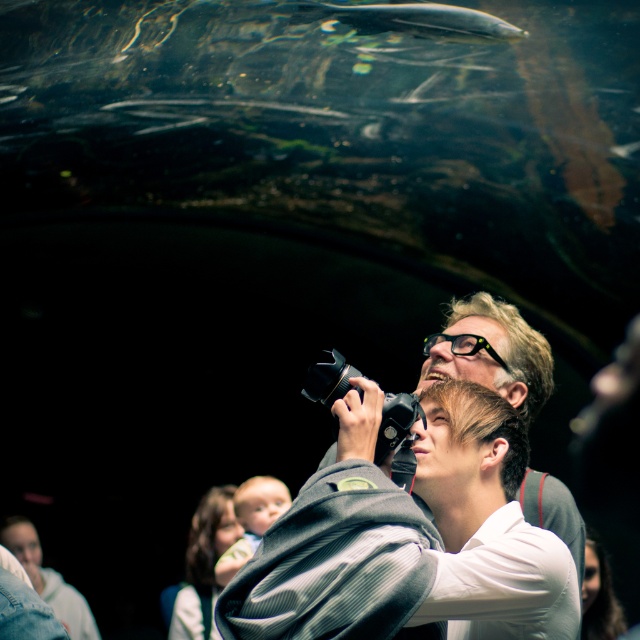
Question: Which object appears closest to the camera in this image?

Choices:
 (A) silvery smooth fish at upper center
 (B) matte gray jacket at center

Answer: (B)

Question: Considering the relative positions of matte gray jacket at center and silvery smooth fish at upper center in the image provided, where is matte gray jacket at center located with respect to silvery smooth fish at upper center?

Choices:
 (A) above
 (B) below

Answer: (B)

Question: Among these objects, which one is farthest from the camera?

Choices:
 (A) matte gray jacket at center
 (B) silvery smooth fish at upper center

Answer: (B)

Question: Can you confirm if matte gray jacket at center is positioned above silvery smooth fish at upper center?

Choices:
 (A) no
 (B) yes

Answer: (A)

Question: In this image, where is matte gray jacket at center located relative to silvery smooth fish at upper center?

Choices:
 (A) right
 (B) left

Answer: (B)

Question: Which point is farther to the camera?

Choices:
 (A) matte gray jacket at center
 (B) silvery smooth fish at upper center

Answer: (B)